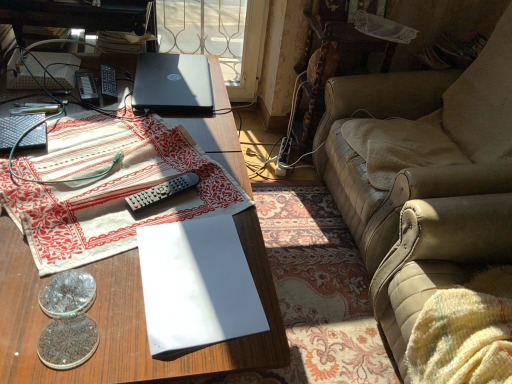
You are a GUI agent. You are given a task and a screenshot of the screen. Output one action in this format:
    pyautogui.click(x=<x>, y=<y>)
    Task: Click on the empty space that is in between white paper at left, the second paperback book when ordered from right to left, and black plastic remote control at upper left, which is counted as the second remote control, starting from the bottom
    The image size is (512, 384).
    Given the screenshot: What is the action you would take?
    pyautogui.click(x=56, y=91)